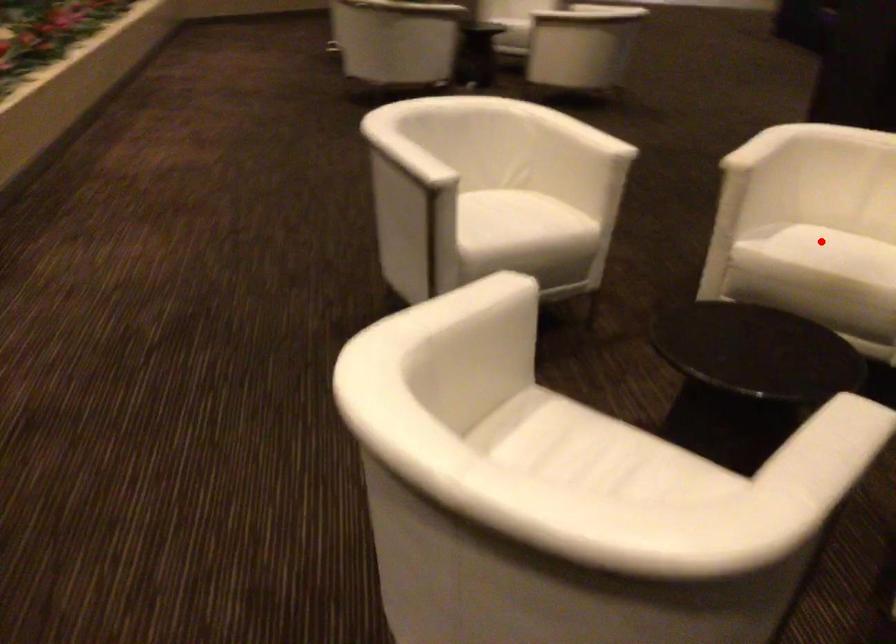
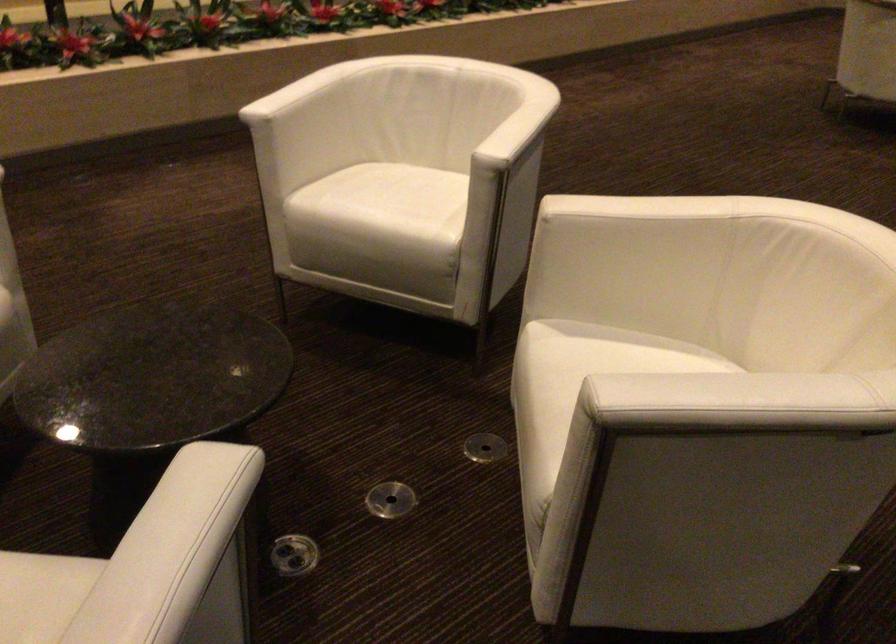
Find the pixel in the second image that matches the highlighted location in the first image.

(581, 366)